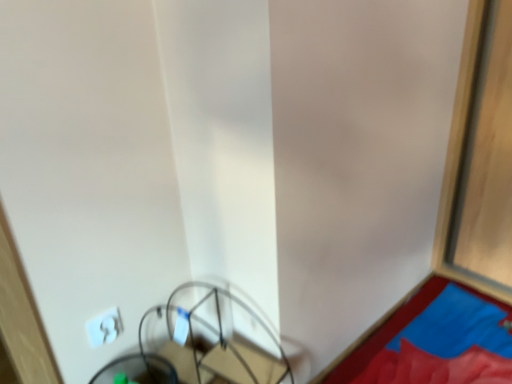
Measure the distance between point (113, 326) and camera.

The depth of point (113, 326) is 3.94 feet.

In order to click on blue fabric at lower right in this screenshot , I will do `click(447, 344)`.

In terms of size, does metal wire basket at lower center appear bigger or smaller than white plastic light switch at lower left?

metal wire basket at lower center is bigger than white plastic light switch at lower left.

Where is `light switch on the left side of metal wire basket at lower center`? This screenshot has width=512, height=384. light switch on the left side of metal wire basket at lower center is located at coordinates point(104,327).

In terms of width, does metal wire basket at lower center look wider or thinner when compared to white plastic light switch at lower left?

Considering their sizes, metal wire basket at lower center looks broader than white plastic light switch at lower left.

Which is in front, metal wire basket at lower center or white plastic light switch at lower left?

metal wire basket at lower center is more forward.

Which is farther, [164,374] or [447,350]?

The point [447,350] is behind.

From a real-world perspective, is metallic wire swivel chair at lower left positioned over blue fabric at lower right based on gravity?

Yes, from a real-world perspective, metallic wire swivel chair at lower left is above blue fabric at lower right.

Is metallic wire swivel chair at lower left taller than blue fabric at lower right?

Correct, metallic wire swivel chair at lower left is much taller as blue fabric at lower right.

Does metal wire basket at lower center have a larger size compared to blue fabric at lower right?

No.

Choose the correct answer: Is metal wire basket at lower center inside blue fabric at lower right or outside it?

metal wire basket at lower center is spatially situated outside blue fabric at lower right.

Who is shorter, metal wire basket at lower center or blue fabric at lower right?

Standing shorter between the two is blue fabric at lower right.

Identify the location of sheet below the metal wire basket at lower center (from the image's perspective). (447, 344).

Is metal wire basket at lower center closer to camera compared to metallic wire swivel chair at lower left?

Yes, metal wire basket at lower center is in front of metallic wire swivel chair at lower left.

Is metal wire basket at lower center at the right side of metallic wire swivel chair at lower left?

Correct, you'll find metal wire basket at lower center to the right of metallic wire swivel chair at lower left.

In the image, there is a metal wire basket at lower center. Where is `swivel chair below it (from the image's perspective)`? Image resolution: width=512 pixels, height=384 pixels. swivel chair below it (from the image's perspective) is located at coordinates (137, 370).

From the image's perspective, which is above, metallic wire swivel chair at lower left or white plastic light switch at lower left?

white plastic light switch at lower left is shown above in the image.

Which point is more distant from viewer, (124, 371) or (112, 332)?

The point (124, 371) is more distant.

Between metallic wire swivel chair at lower left and white plastic light switch at lower left, which one has smaller width?

Thinner between the two is white plastic light switch at lower left.

Does metallic wire swivel chair at lower left have a smaller size compared to white plastic light switch at lower left?

No.

Considering the sizes of objects blue fabric at lower right and metal wire basket at lower center in the image provided, who is wider, blue fabric at lower right or metal wire basket at lower center?

blue fabric at lower right is wider.

Is blue fabric at lower right completely or partially outside of metal wire basket at lower center?

Yes.

Based on their sizes in the image, would you say blue fabric at lower right is bigger or smaller than metal wire basket at lower center?

blue fabric at lower right is bigger than metal wire basket at lower center.

Is there a large distance between blue fabric at lower right and metal wire basket at lower center?

No, there isn't a large distance between blue fabric at lower right and metal wire basket at lower center.

Measure the distance from blue fabric at lower right to white plastic light switch at lower left.

A distance of 38.65 inches exists between blue fabric at lower right and white plastic light switch at lower left.

Does point (446, 374) come behind point (109, 330)?

Yes.

Is blue fabric at lower right situated inside white plastic light switch at lower left or outside?

The correct answer is: outside.

You are a GUI agent. You are given a task and a screenshot of the screen. Output one action in this format:
    pyautogui.click(x=<x>, y=<y>)
    Task: Click on the light switch that is above the metal wire basket at lower center (from the image's perspective)
    The height and width of the screenshot is (384, 512).
    Given the screenshot: What is the action you would take?
    pyautogui.click(x=104, y=327)

Where is `sheet lying on the right of metallic wire swivel chair at lower left`? The image size is (512, 384). sheet lying on the right of metallic wire swivel chair at lower left is located at coordinates (447, 344).

Which object lies further to the anchor point white plastic light switch at lower left, blue fabric at lower right or metallic wire swivel chair at lower left?

blue fabric at lower right is further to white plastic light switch at lower left.

Looking at the image, which one is located closer to metallic wire swivel chair at lower left, blue fabric at lower right or white plastic light switch at lower left?

Among the two, white plastic light switch at lower left is located nearer to metallic wire swivel chair at lower left.

Estimate the real-world distances between objects in this image. Which object is further from blue fabric at lower right, metallic wire swivel chair at lower left or metal wire basket at lower center?

metallic wire swivel chair at lower left is further to blue fabric at lower right.

Considering their positions, is metallic wire swivel chair at lower left positioned further to metal wire basket at lower center than blue fabric at lower right?

blue fabric at lower right lies further to metal wire basket at lower center than the other object.

Which object lies further to the anchor point blue fabric at lower right, metal wire basket at lower center or metallic wire swivel chair at lower left?

metallic wire swivel chair at lower left.

When comparing their distances from white plastic light switch at lower left, does blue fabric at lower right or metal wire basket at lower center seem closer?

Based on the image, metal wire basket at lower center appears to be nearer to white plastic light switch at lower left.

Based on their spatial positions, is white plastic light switch at lower left or metallic wire swivel chair at lower left closer to blue fabric at lower right?

metallic wire swivel chair at lower left is closer to blue fabric at lower right.

Which object lies further to the anchor point metal wire basket at lower center, white plastic light switch at lower left or metallic wire swivel chair at lower left?

white plastic light switch at lower left is positioned further to the anchor metal wire basket at lower center.

This screenshot has height=384, width=512. I want to click on furniture between white plastic light switch at lower left and blue fabric at lower right in the horizontal direction, so click(x=203, y=342).

At what (x,y) coordinates should I click in order to perform the action: click on swivel chair between white plastic light switch at lower left and metal wire basket at lower center in the horizontal direction. Please return your answer as a coordinate pair (x, y). The image size is (512, 384). Looking at the image, I should click on (137, 370).

Find the location of a particular element. swivel chair between white plastic light switch at lower left and blue fabric at lower right in the horizontal direction is located at coordinates (137, 370).

This screenshot has height=384, width=512. In order to click on furniture situated between metallic wire swivel chair at lower left and blue fabric at lower right from left to right in this screenshot , I will do `click(203, 342)`.